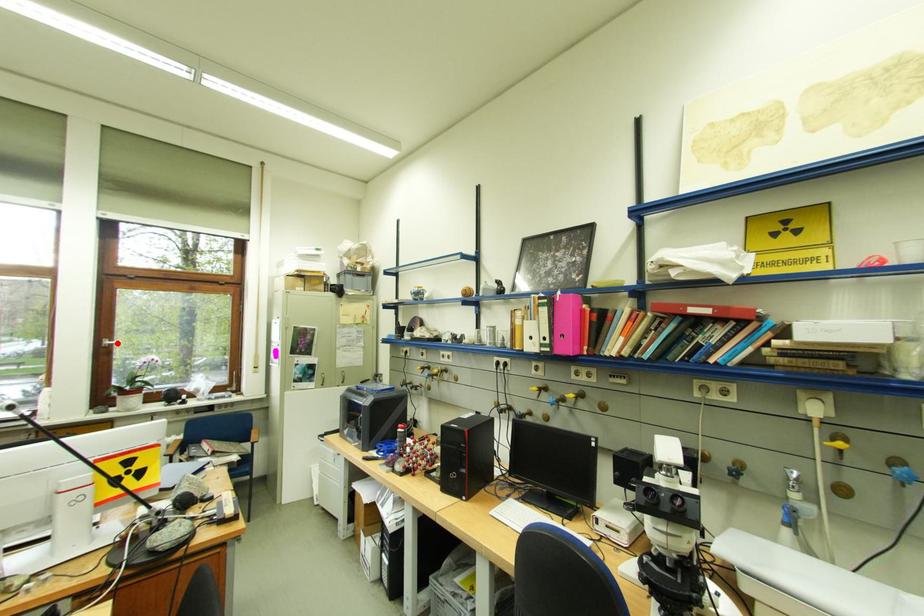
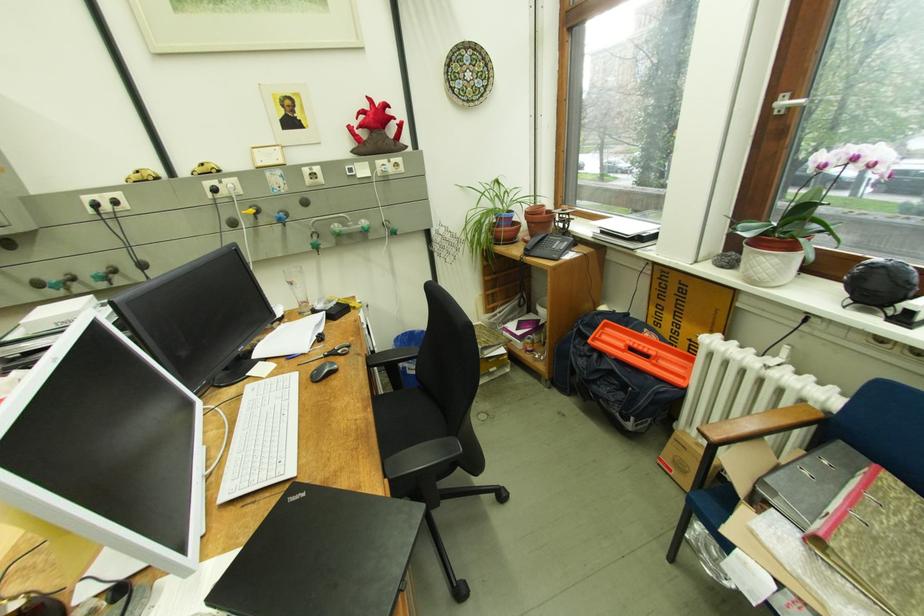
Question: I am providing you with two images of the same scene from different viewpoints. A red point is marked on the first image. At the location where the point appears in image 1, is it still visible in image 2?

Choices:
 (A) Yes
 (B) No

Answer: (A)